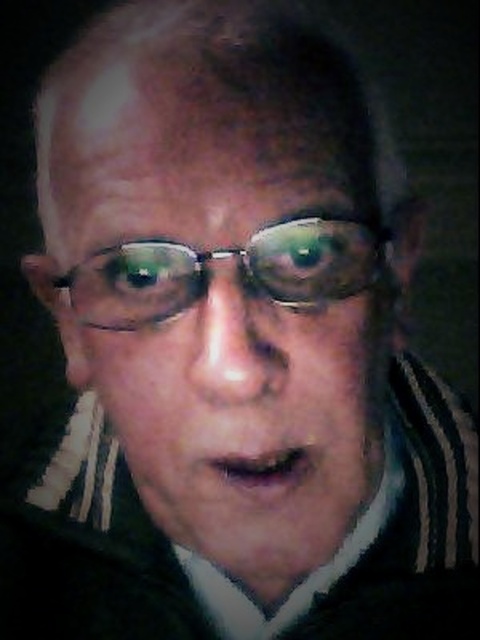
What are the coordinates of the matte black face at center?

The matte black face at center is located at coordinates point (x=224, y=333).

You are an artist trying to sketch this person. You need to decide the order to draw the two points based on their depth. Which point should you draw first, the one at point (x=334, y=396) or the one at point (x=360, y=228)?

Point (x=334, y=396) is in front of point (x=360, y=228), so you should draw the point at (x=334, y=396) first to create depth in your sketch.

You are a photographer adjusting the focus on your camera. You notice the matte black face at center and the clear plastic glasses at center in your viewfinder. Which object should you focus on first if you want to ensure the larger subject is sharp?

The matte black face at center has a larger size compared to the clear plastic glasses at center, so you should focus on the matte black face at center first to ensure the larger subject is sharp.